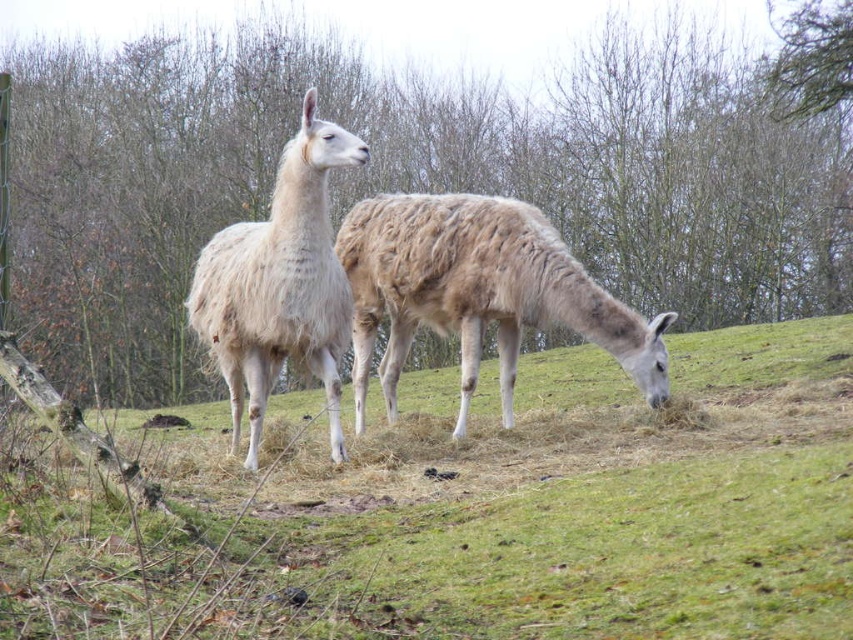
Question: Which point is closer to the camera?

Choices:
 (A) brown leafy tree at upper center
 (B) green grassy at center
 (C) white fluffy alpaca at center
 (D) fuzzy beige camel at center

Answer: (B)

Question: Observing the image, what is the correct spatial positioning of green grassy at center in reference to fuzzy beige camel at center?

Choices:
 (A) left
 (B) right

Answer: (A)

Question: Does brown leafy tree at upper center appear on the right side of fuzzy beige camel at center?

Choices:
 (A) yes
 (B) no

Answer: (B)

Question: Which point is farther to the camera?

Choices:
 (A) white fluffy alpaca at center
 (B) brown leafy tree at upper center
 (C) green grassy at center

Answer: (A)

Question: Which of these objects is positioned closest to the brown leafy tree at upper center?

Choices:
 (A) green grassy at center
 (B) white fluffy alpaca at center
 (C) fuzzy beige camel at center

Answer: (C)

Question: Is green grassy at center closer to the viewer compared to white fluffy alpaca at center?

Choices:
 (A) yes
 (B) no

Answer: (A)